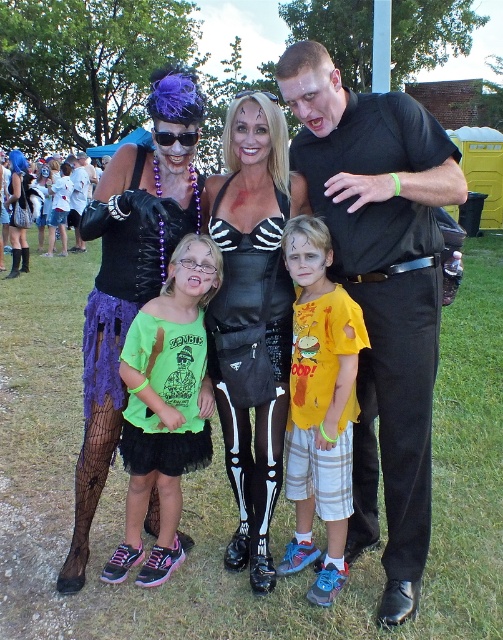
From the picture: You are standing in front of the group of people in the Halloween scene. You notice two points marked on the image at coordinates point (313, 326) and point (58, 188). Which of these points is closer to you?

Point (313, 326) is closer to the viewer than point (58, 188).

You are a photographer at the Halloween event. You need to adjust the lighting so that the black matte shirt at center and the matte purple wig at upper left are both visible. Which object should you focus on first to ensure proper exposure?

The matte purple wig at upper left should be focused on first because the black matte shirt at center is below it, so adjusting the lighting for the wig will help ensure the shirt is also properly exposed.